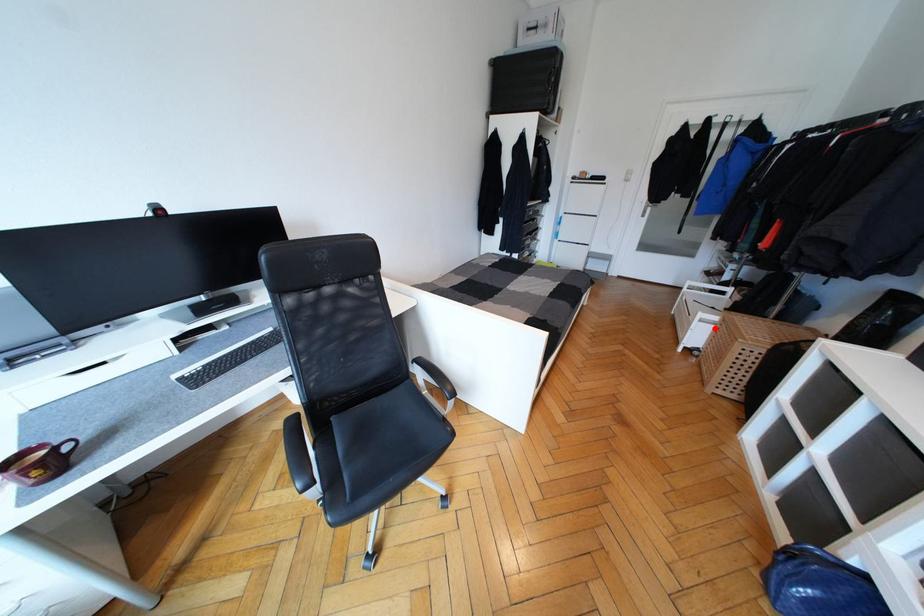
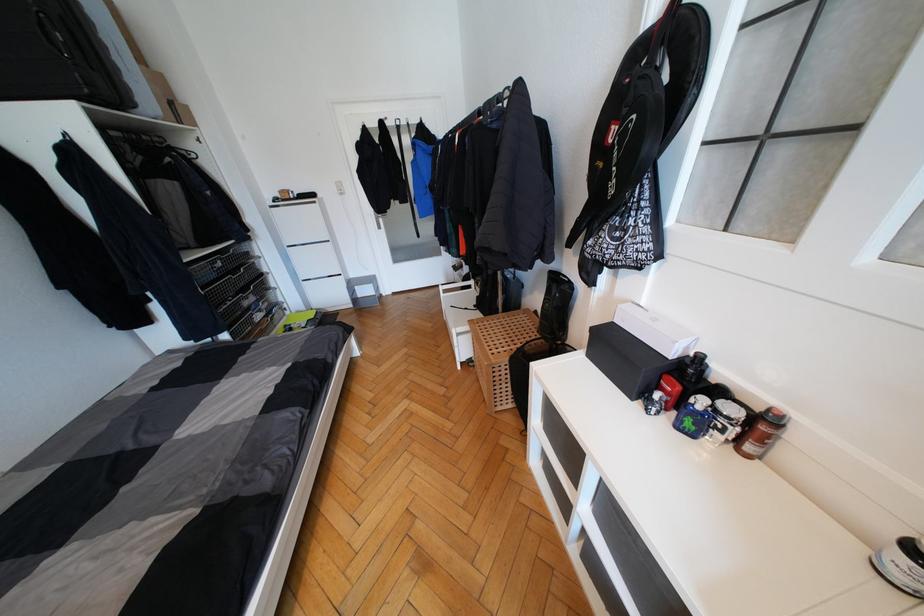
Find the pixel in the second image that matches the highlighted location in the first image.

(472, 338)